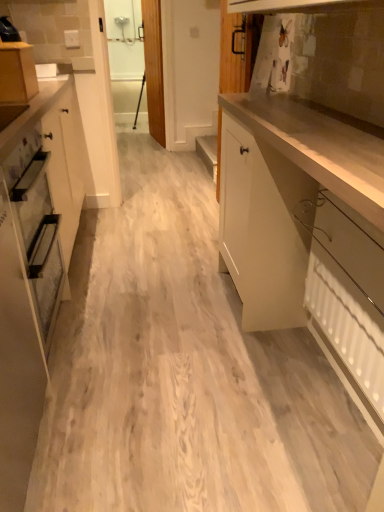
This screenshot has height=512, width=384. Find the location of `free space to the left of glossy white cabinet at right, the 3th cabinetry positioned from the left`. free space to the left of glossy white cabinet at right, the 3th cabinetry positioned from the left is located at coordinates (156, 355).